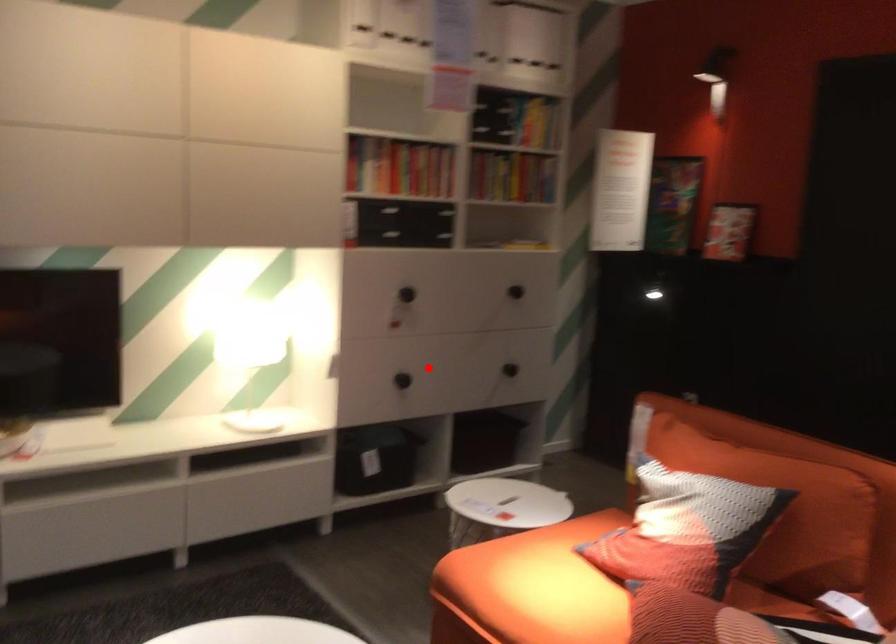
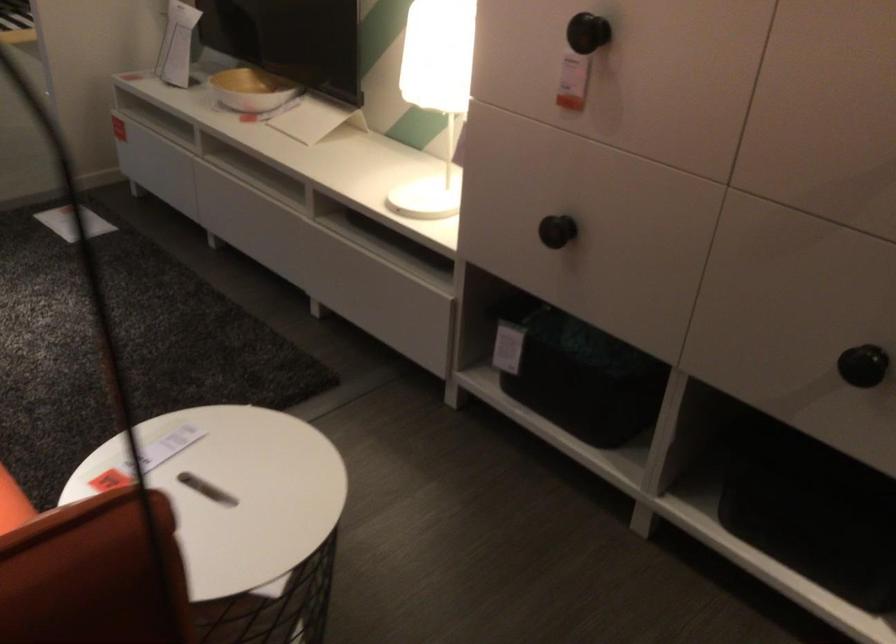
In the second image, find the point that corresponds to the highlighted location in the first image.

(556, 231)